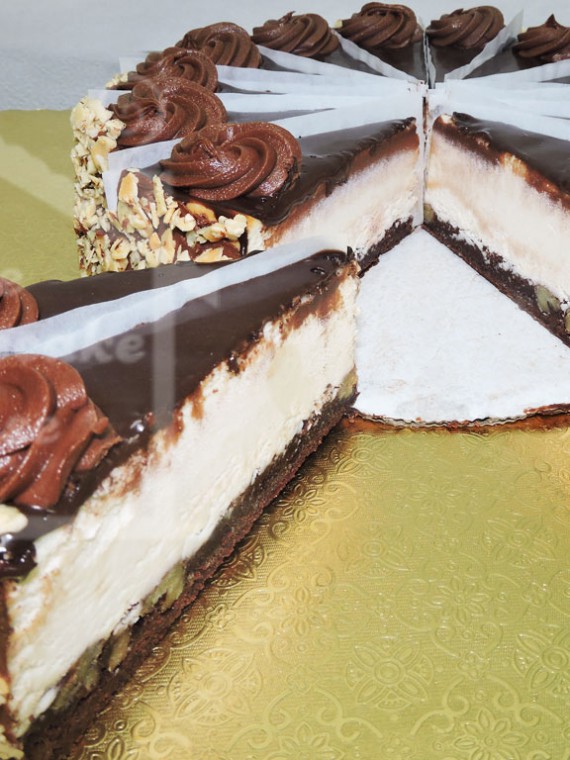
Locate an element on the screen. damask print is located at coordinates (337, 730).